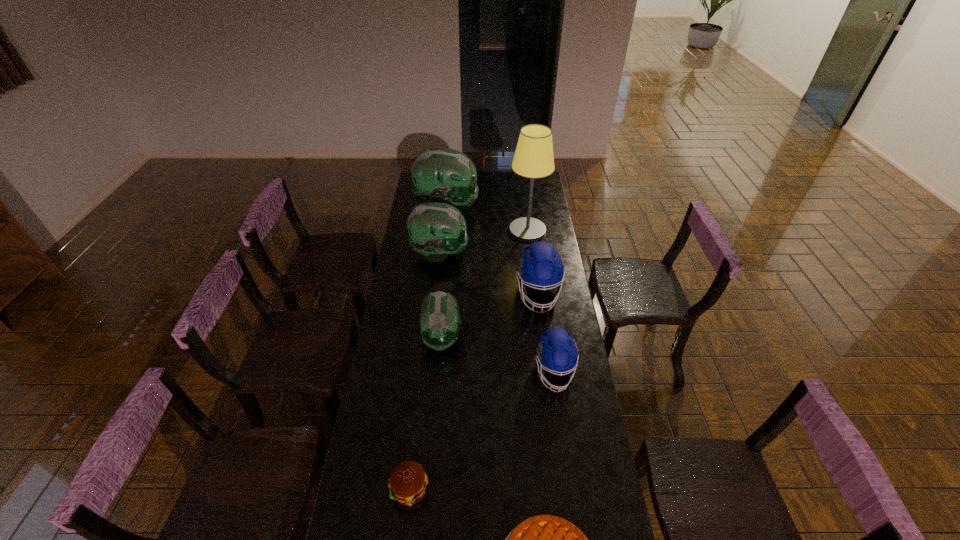
Locate an element on the screen. The height and width of the screenshot is (540, 960). table lamp is located at coordinates (533, 158).

The width and height of the screenshot is (960, 540). Find the location of `the farthest green football helmet`. the farthest green football helmet is located at coordinates (443, 175).

You are a GUI agent. You are given a task and a screenshot of the screen. Output one action in this format:
    pyautogui.click(x=<x>, y=<y>)
    Task: Click on the biggest green football helmet
    This screenshot has width=960, height=540.
    Given the screenshot: What is the action you would take?
    pyautogui.click(x=443, y=175)

Find the location of a particular element. This screenshot has height=540, width=960. the second smallest green football helmet is located at coordinates (435, 230).

Where is `the fourth nearest football helmet`? This screenshot has height=540, width=960. the fourth nearest football helmet is located at coordinates (435, 230).

I want to click on the farther blue football helmet, so click(540, 265).

In order to click on the bigger blue football helmet in this screenshot , I will do `click(540, 265)`.

Identify the location of the smallest green football helmet. This screenshot has height=540, width=960. (439, 323).

In order to click on the nearer blue football helmet in this screenshot , I will do click(x=556, y=350).

What are the coordinates of `hamburger` in the screenshot? It's located at (407, 484).